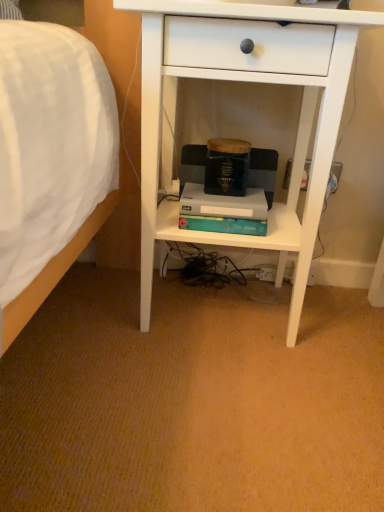
This screenshot has height=512, width=384. What are the coordinates of `free spot to the left of white matte desk at center` in the screenshot? It's located at [x=81, y=316].